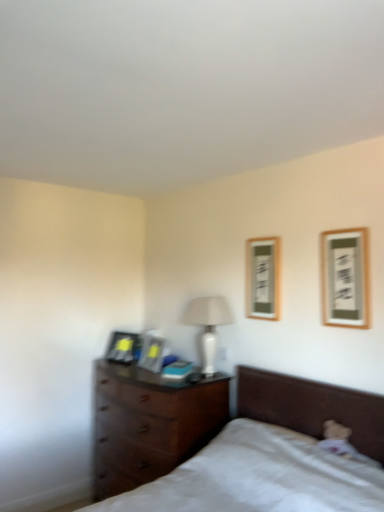
Question: Is wooden picture frame at upper right, marked as the 2th picture frame in a right-to-left arrangement, aimed at matte black picture frame at center, which is the 2th picture frame from left to right?

Choices:
 (A) yes
 (B) no

Answer: (B)

Question: Considering the relative sizes of wooden picture frame at upper right, marked as the 2th picture frame in a right-to-left arrangement, and matte black picture frame at center, which appears as the second picture frame when viewed from the back, in the image provided, is wooden picture frame at upper right, marked as the 2th picture frame in a right-to-left arrangement, thinner than matte black picture frame at center, which appears as the second picture frame when viewed from the back,?

Choices:
 (A) no
 (B) yes

Answer: (B)

Question: Does wooden picture frame at upper right, arranged as the third picture frame when viewed from the back, have a greater height compared to matte black picture frame at center, acting as the third picture frame starting from the right?

Choices:
 (A) no
 (B) yes

Answer: (B)

Question: Is wooden picture frame at upper right, marked as the 2th picture frame in a right-to-left arrangement, in front of matte black picture frame at center, acting as the third picture frame starting from the right?

Choices:
 (A) yes
 (B) no

Answer: (A)

Question: From the image's perspective, is wooden picture frame at upper right, arranged as the third picture frame when viewed from the back, on matte black picture frame at center, which is the 3th picture frame in front-to-back order?

Choices:
 (A) no
 (B) yes

Answer: (B)

Question: Does wooden picture frame at upper right, marked as the 2th picture frame in a right-to-left arrangement, come behind matte black picture frame at center, which is the 2th picture frame from left to right?

Choices:
 (A) yes
 (B) no

Answer: (B)

Question: Is dark wood chest of drawers at lower left located within wooden framed picture at upper right, the 1th picture frame in the right-to-left sequence?

Choices:
 (A) no
 (B) yes

Answer: (A)

Question: Is wooden framed picture at upper right, the 1th picture frame in the right-to-left sequence, located outside dark wood chest of drawers at lower left?

Choices:
 (A) no
 (B) yes

Answer: (B)

Question: Does wooden framed picture at upper right, the first picture frame from the front, have a greater height compared to dark wood chest of drawers at lower left?

Choices:
 (A) no
 (B) yes

Answer: (A)

Question: Is wooden framed picture at upper right, the first picture frame from the front, looking in the opposite direction of dark wood chest of drawers at lower left?

Choices:
 (A) yes
 (B) no

Answer: (B)

Question: Are wooden framed picture at upper right, the fourth picture frame positioned from the back, and dark wood chest of drawers at lower left located far from each other?

Choices:
 (A) no
 (B) yes

Answer: (B)

Question: Is wooden framed picture at upper right, the 1th picture frame in the right-to-left sequence, in front of dark wood chest of drawers at lower left?

Choices:
 (A) yes
 (B) no

Answer: (A)

Question: Is matte black picture frame at left, which is the fourth picture frame in right-to-left order, shorter than matte black picture frame at center, which appears as the second picture frame when viewed from the back?

Choices:
 (A) no
 (B) yes

Answer: (B)